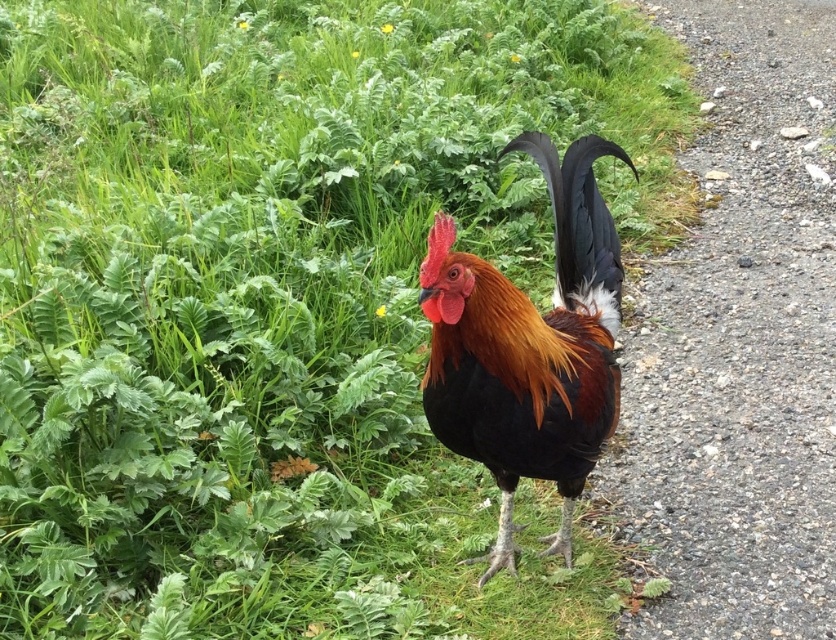
Question: Which point is farther to the camera?

Choices:
 (A) gravelly path at right
 (B) shiny black rooster at center

Answer: (A)

Question: Which object appears farthest from the camera in this image?

Choices:
 (A) shiny black rooster at center
 (B) gravelly path at right

Answer: (B)

Question: Is gravelly path at right in front of shiny black rooster at center?

Choices:
 (A) yes
 (B) no

Answer: (B)

Question: Observing the image, what is the correct spatial positioning of gravelly path at right in reference to shiny black rooster at center?

Choices:
 (A) left
 (B) right

Answer: (B)

Question: Does gravelly path at right have a larger size compared to shiny black rooster at center?

Choices:
 (A) no
 (B) yes

Answer: (B)